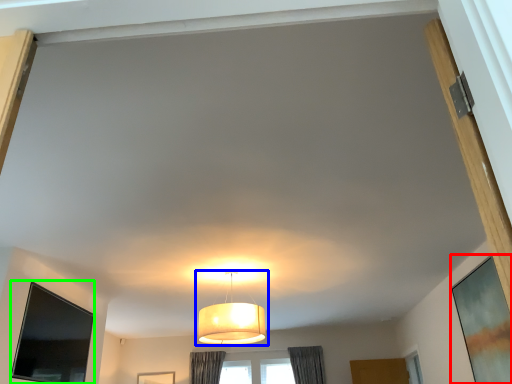
Question: Which object is the closest to the window screen (highlighted by a red box)? Choose among these: lamp (highlighted by a blue box) or window screen (highlighted by a green box).

Choices:
 (A) lamp
 (B) window screen

Answer: (A)